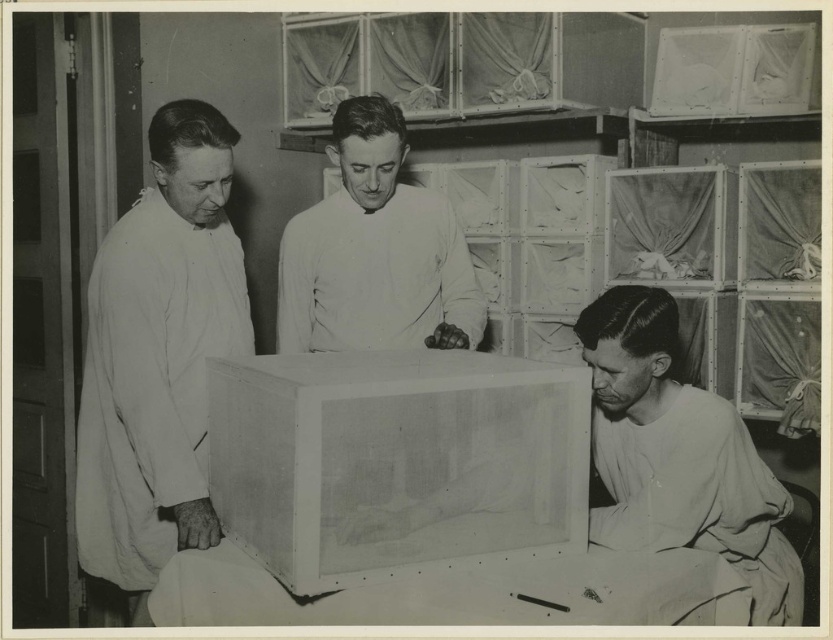
Consider the image. Who is positioned more to the right, white cloth at left or white matte coat at center?

Positioned to the right is white matte coat at center.

Is white cloth at left above white matte coat at center?

No, white cloth at left is not above white matte coat at center.

The image size is (833, 640). I want to click on white cloth at left, so click(158, 355).

Can you confirm if smooth white shirt at lower right is thinner than white matte coat at center?

Correct, smooth white shirt at lower right's width is less than white matte coat at center's.

Is point (711, 448) in front of point (383, 122)?

Yes.

This screenshot has width=833, height=640. Find the location of `smooth white shirt at lower right`. smooth white shirt at lower right is located at coordinates (679, 456).

Does translucent plastic box at center have a lesser width compared to white cloth at left?

Incorrect, translucent plastic box at center's width is not less than white cloth at left's.

Can you confirm if translucent plastic box at center is shorter than white cloth at left?

Yes, translucent plastic box at center is shorter than white cloth at left.

Between point (328, 420) and point (103, 532), which one is positioned in front?

Positioned in front is point (328, 420).

The image size is (833, 640). I want to click on translucent plastic box at center, so click(395, 460).